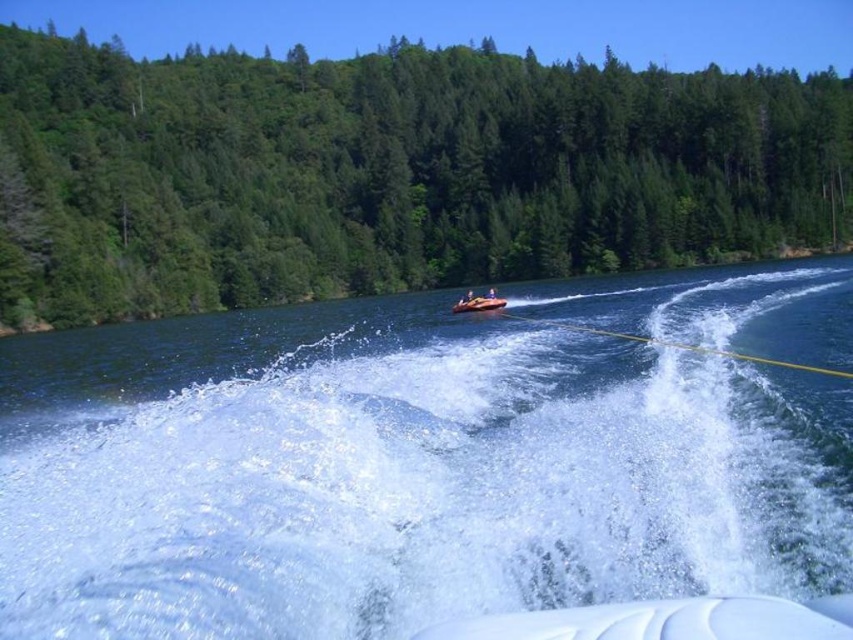
You are a photographer trying to capture the orange rubber raft at center and the green textured trees at center in a single shot. Based on their positions, which object should you focus on first to ensure both are in frame?

The green textured trees at center are to the left of the orange rubber raft at center, so you should focus on the orange rubber raft at center first to ensure both are captured in the frame.

You are a photographer planning to capture a wide shot of the orange rubber raft at center and the green textured trees at center in the lake scene. Based on their sizes, which object should you focus on first to ensure it is in sharp focus if you want both to be clear?

The green textured trees at center is larger in size than the orange rubber raft at center, so focusing on the larger green textured trees at center first would help ensure both are in focus as it occupies more of the frame.

You are a photographer trying to capture the clear water at center and the green textured trees at center in a single shot. Which object will appear larger in your photo?

The clear water at center will appear larger in the photo because it is closer to the viewer than the green textured trees at center.